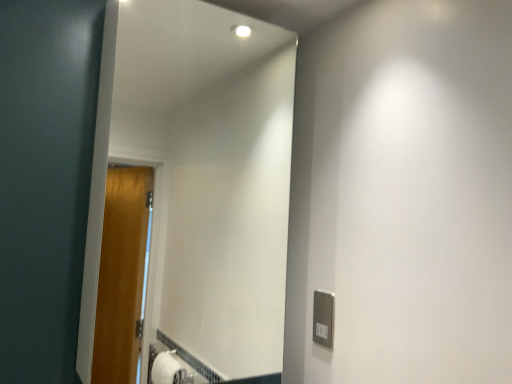
What do you see at coordinates (323, 318) in the screenshot? The image size is (512, 384). I see `white plastic outlet at lower right` at bounding box center [323, 318].

Locate an element on the screen. The image size is (512, 384). white plastic outlet at lower right is located at coordinates (323, 318).

What is the approximate width of white plastic outlet at lower right?

white plastic outlet at lower right is 0.74 inches wide.

This screenshot has width=512, height=384. What are the coordinates of `white glossy mirror at center` in the screenshot? It's located at (190, 193).

Describe the element at coordinates (190, 193) in the screenshot. I see `white glossy mirror at center` at that location.

At what (x,y) coordinates should I click in order to perform the action: click on white plastic outlet at lower right. Please return your answer as a coordinate pair (x, y). The width and height of the screenshot is (512, 384). Looking at the image, I should click on (323, 318).

In the image, is white glossy mirror at center on the left side or the right side of white plastic outlet at lower right?

Based on their positions, white glossy mirror at center is located to the left of white plastic outlet at lower right.

Is white glossy mirror at center positioned before white plastic outlet at lower right?

Yes, the depth of white glossy mirror at center is less than that of white plastic outlet at lower right.

Which is in front, point (288, 202) or point (330, 326)?

The point (330, 326) is more forward.

From the image's perspective, is white glossy mirror at center located above white plastic outlet at lower right?

Yes, from the image's perspective, white glossy mirror at center is above white plastic outlet at lower right.

From a real-world perspective, is white glossy mirror at center positioned above or below white plastic outlet at lower right?

white glossy mirror at center is above white plastic outlet at lower right.

Is white glossy mirror at center wider or thinner than white plastic outlet at lower right?

In the image, white glossy mirror at center appears to be wider than white plastic outlet at lower right.

In terms of height, does white glossy mirror at center look taller or shorter compared to white plastic outlet at lower right?

Considering their sizes, white glossy mirror at center has more height than white plastic outlet at lower right.

Considering the relative sizes of white glossy mirror at center and white plastic outlet at lower right in the image provided, is white glossy mirror at center bigger than white plastic outlet at lower right?

Correct, white glossy mirror at center is larger in size than white plastic outlet at lower right.

Could white plastic outlet at lower right be considered to be inside white glossy mirror at center?

No, white plastic outlet at lower right is not a part of white glossy mirror at center.

Is white glossy mirror at center touching white plastic outlet at lower right?

No, white glossy mirror at center is not beside white plastic outlet at lower right.

Could you tell me if white glossy mirror at center is turned towards white plastic outlet at lower right?

No, white glossy mirror at center is not facing towards white plastic outlet at lower right.

What's the angular difference between white glossy mirror at center and white plastic outlet at lower right's facing directions?

white glossy mirror at center and white plastic outlet at lower right are facing 92.5 degrees away from each other.

How distant is white glossy mirror at center from white plastic outlet at lower right?

1.05 meters.

What are the coordinates of `mirror that is on the left side of white plastic outlet at lower right` in the screenshot? It's located at (190, 193).

Is white plastic outlet at lower right to the right of white glossy mirror at center from the viewer's perspective?

Indeed, white plastic outlet at lower right is positioned on the right side of white glossy mirror at center.

Relative to white glossy mirror at center, is white plastic outlet at lower right in front or behind?

white plastic outlet at lower right is behind white glossy mirror at center.

Between point (314, 331) and point (272, 349), which one is positioned behind?

The point (272, 349) is more distant.

From the image's perspective, would you say white plastic outlet at lower right is shown under white glossy mirror at center?

Yes.

From a real-world perspective, is white plastic outlet at lower right physically below white glossy mirror at center?

Yes, from a real-world perspective, white plastic outlet at lower right is under white glossy mirror at center.

Does white plastic outlet at lower right have a lesser width compared to white glossy mirror at center?

Indeed, white plastic outlet at lower right has a lesser width compared to white glossy mirror at center.

Considering the sizes of white plastic outlet at lower right and white glossy mirror at center in the image, is white plastic outlet at lower right taller or shorter than white glossy mirror at center?

Considering their sizes, white plastic outlet at lower right has less height than white glossy mirror at center.

Can you confirm if white plastic outlet at lower right is bigger than white glossy mirror at center?

No.

Is white plastic outlet at lower right outside of white glossy mirror at center?

white plastic outlet at lower right is positioned outside white glossy mirror at center.

Is white plastic outlet at lower right not close to white glossy mirror at center?

That's right, there is a large distance between white plastic outlet at lower right and white glossy mirror at center.

Is white plastic outlet at lower right oriented towards white glossy mirror at center?

Yes, white plastic outlet at lower right is aimed at white glossy mirror at center.

How different are the orientations of white plastic outlet at lower right and white glossy mirror at center in degrees?

92.5 degrees.

At what (x,y) coordinates should I click in order to perform the action: click on mirror lying in front of the white plastic outlet at lower right. Please return your answer as a coordinate pair (x, y). The height and width of the screenshot is (384, 512). Looking at the image, I should click on (190, 193).

Find the location of `electric outlet below the white glossy mirror at center (from a real-world perspective)`. electric outlet below the white glossy mirror at center (from a real-world perspective) is located at coordinates (323, 318).

Identify the location of electric outlet on the right of the white glossy mirror at center. This screenshot has height=384, width=512. (323, 318).